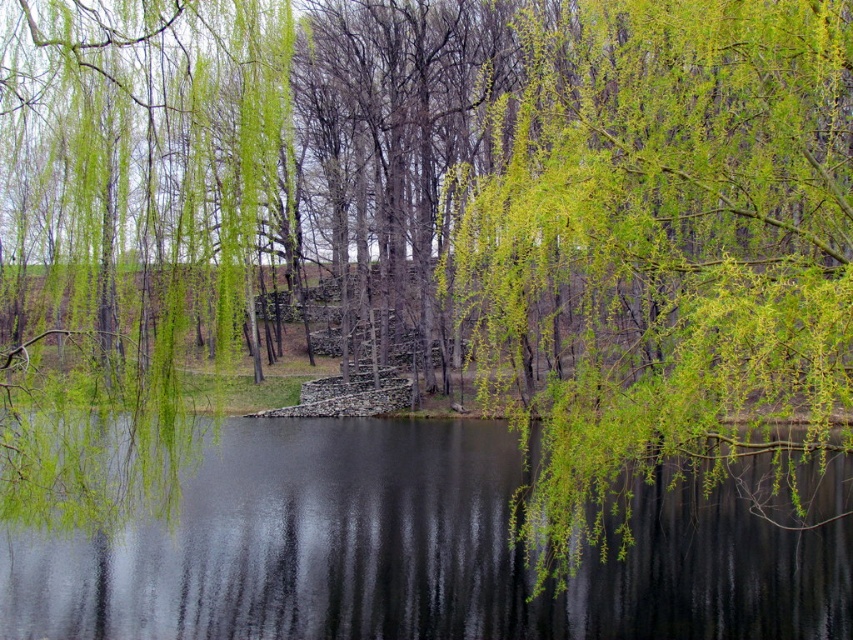
You are standing on the dock and want to see the reflection of the green leafy willow at center in the transparent water at center. Is the reflection visible?

Yes, the reflection is visible because the transparent water at center is located below the green leafy willow at center, allowing its reflection to be seen on the water surface.